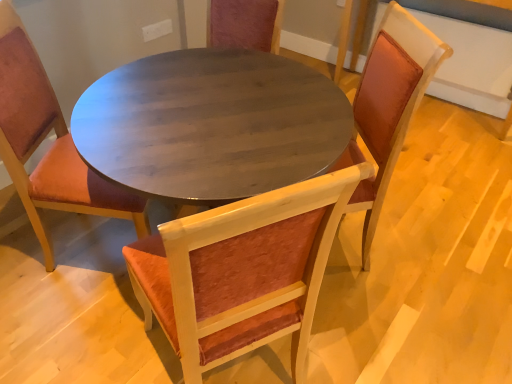
The height and width of the screenshot is (384, 512). What are the coordinates of `unoccupied region to the right of velvet orange chair at center, which ranks as the first chair in right-to-left order` in the screenshot? It's located at (418, 260).